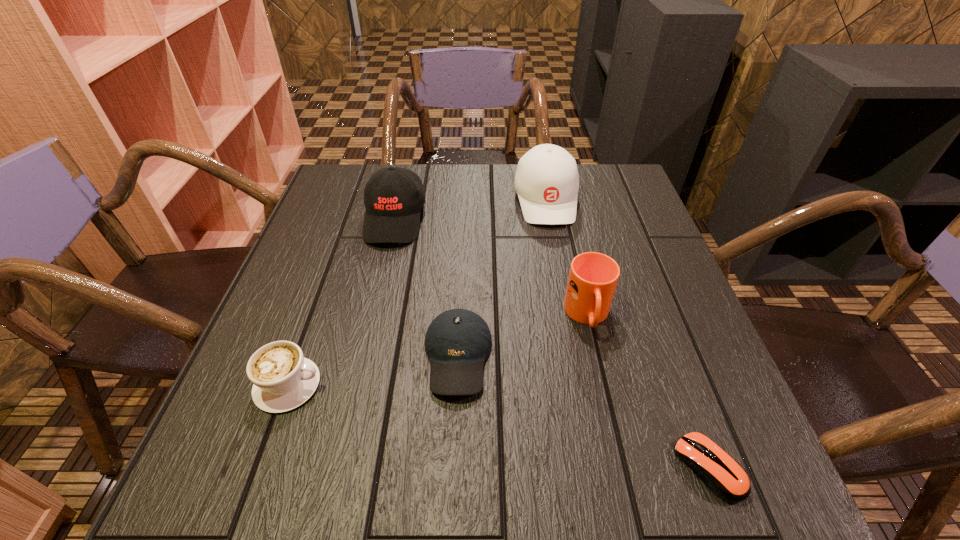
Where is `the rightmost baseball cap`? Image resolution: width=960 pixels, height=540 pixels. the rightmost baseball cap is located at coordinates (547, 182).

The image size is (960, 540). Identify the location of the leftmost baseball cap. (393, 197).

At what (x,y) coordinates should I click in order to perform the action: click on mug. Please return your answer as a coordinate pair (x, y). Looking at the image, I should click on (593, 277).

Locate an element on the screen. The height and width of the screenshot is (540, 960). cappuccino is located at coordinates (282, 378).

You are a GUI agent. You are given a task and a screenshot of the screen. Output one action in this format:
    pyautogui.click(x=<x>, y=<y>)
    Task: Click on the second baseball cap from left to right
    
    Given the screenshot: What is the action you would take?
    pyautogui.click(x=458, y=341)

At what (x,y) coordinates should I click in order to perform the action: click on the shortest baseball cap. Please return your answer as a coordinate pair (x, y). The image size is (960, 540). Looking at the image, I should click on pyautogui.click(x=458, y=341).

Locate an element on the screen. The height and width of the screenshot is (540, 960). the rightmost object is located at coordinates (722, 474).

Identify the location of the shortest object. Image resolution: width=960 pixels, height=540 pixels. (722, 474).

Identify the location of blank space located on the front-facing side of the rightmost baseball cap. (572, 340).

You are a GUI agent. You are given a task and a screenshot of the screen. Output one action in this format:
    pyautogui.click(x=<x>, y=<y>)
    Task: Click on the vacant space situated 0.120m on the front-facing side of the leftmost baseball cap
    This screenshot has height=540, width=960.
    Given the screenshot: What is the action you would take?
    pyautogui.click(x=379, y=285)